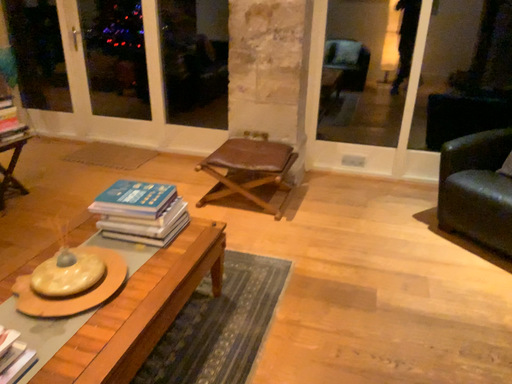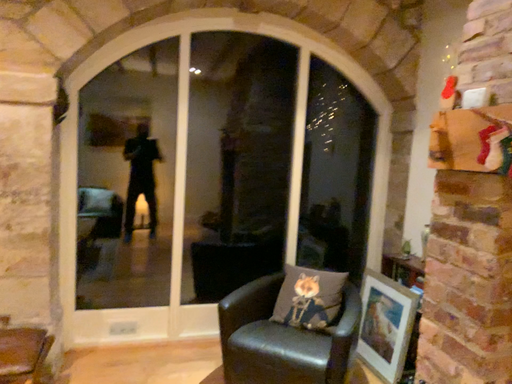
Question: Which way did the camera rotate in the video?

Choices:
 (A) rotated downward
 (B) rotated upward

Answer: (B)